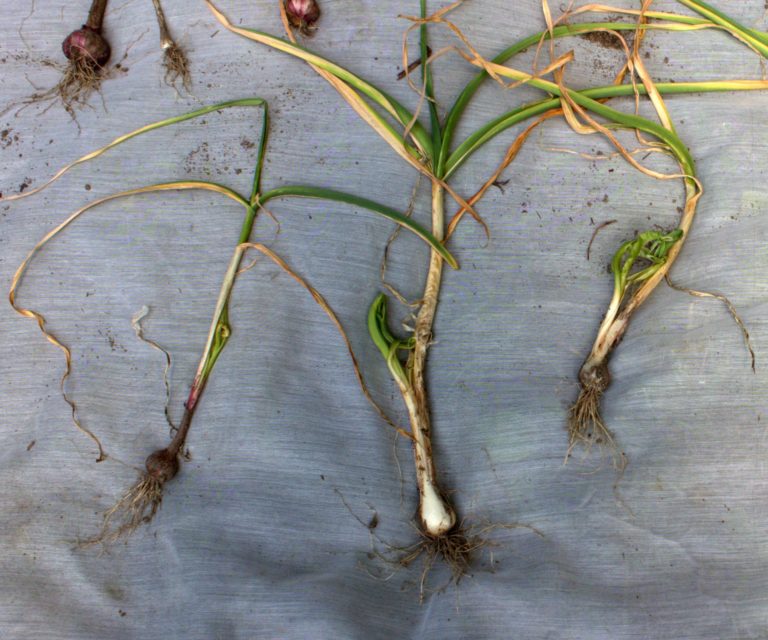
Where is `bulb`? The image size is (768, 640). bulb is located at coordinates (432, 516).